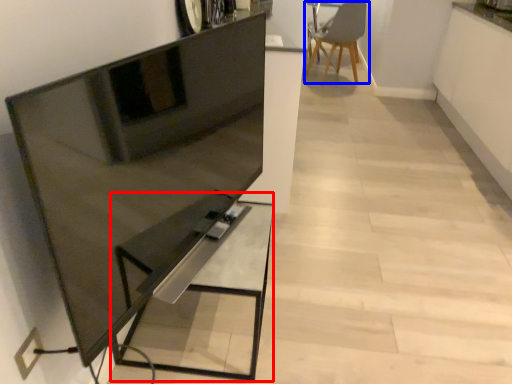
Question: Which point is further to the camera, table (highlighted by a red box) or chair (highlighted by a blue box)?

Choices:
 (A) table
 (B) chair

Answer: (B)